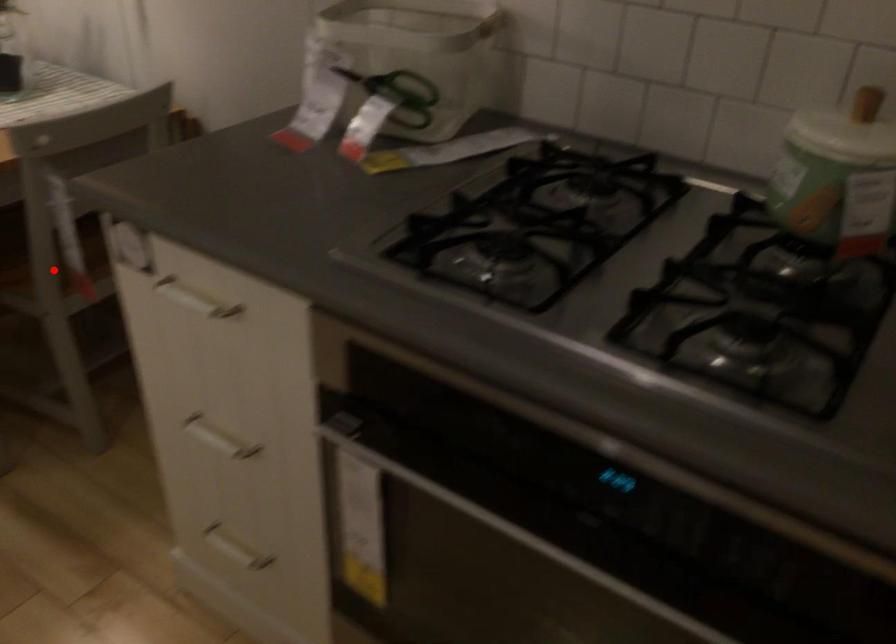
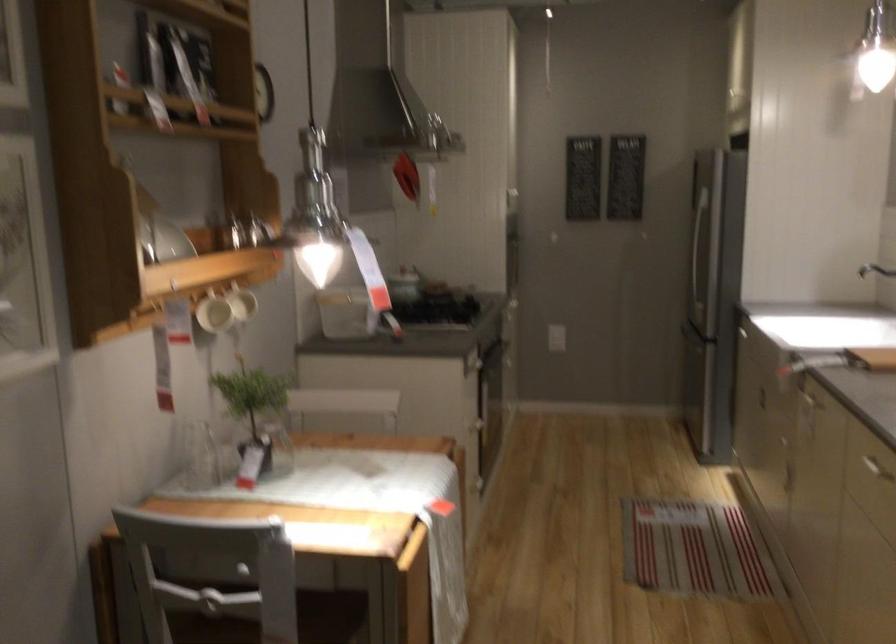
Question: I am providing you with two images of the same scene from different viewpoints. A red point is marked on the first image. Is the red point's position out of view in image 2?

Choices:
 (A) Yes
 (B) No

Answer: (A)